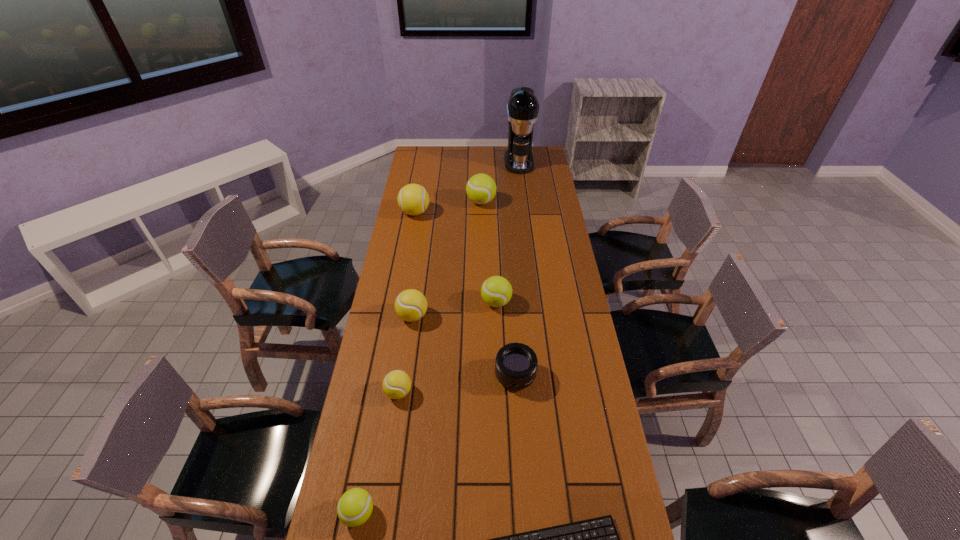
The image size is (960, 540). Identify the location of the farthest object. (522, 109).

Find the location of a particular element. This screenshot has height=540, width=960. coffee maker is located at coordinates (522, 109).

I want to click on the biggest green tennis ball, so [x=481, y=188].

Locate an element on the screen. This screenshot has width=960, height=540. the farthest yellow tennis ball is located at coordinates (413, 199).

Identify the location of the second smallest yellow tennis ball. (410, 305).

Locate an element on the screen. This screenshot has height=540, width=960. the second smallest green tennis ball is located at coordinates (496, 291).

Find the location of a particular element. This screenshot has height=540, width=960. telephoto lens is located at coordinates (516, 364).

You are a GUI agent. You are given a task and a screenshot of the screen. Output one action in this format:
    pyautogui.click(x=<x>, y=<y>)
    Task: Click on the second nearest tennis ball
    
    Given the screenshot: What is the action you would take?
    pyautogui.click(x=396, y=384)

In order to click on the smallest yellow tennis ball in this screenshot , I will do 396,384.

Identify the location of the nearest tennis ball. The height and width of the screenshot is (540, 960). (354, 508).